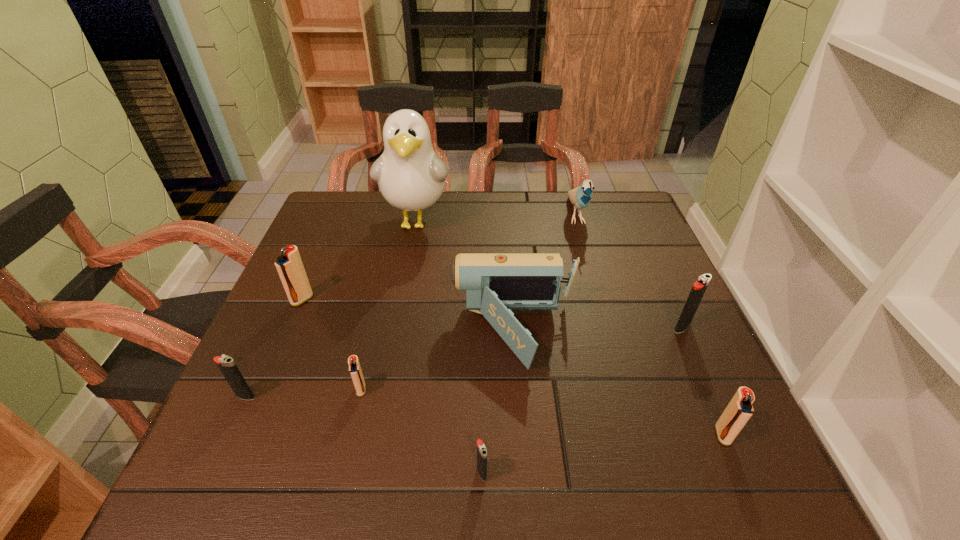
Where is `the leftmost black igniter`? The height and width of the screenshot is (540, 960). the leftmost black igniter is located at coordinates coord(226,364).

Find the location of `the second smallest red igniter`. the second smallest red igniter is located at coordinates (739, 410).

I want to click on the eighth farthest object, so click(x=739, y=410).

The width and height of the screenshot is (960, 540). In order to click on the second red igniter from right to left in this screenshot , I will do `click(355, 371)`.

You are a GUI agent. You are given a task and a screenshot of the screen. Output one action in this format:
    pyautogui.click(x=<x>, y=<y>)
    Task: Click on the smallest red igniter
    
    Given the screenshot: What is the action you would take?
    pyautogui.click(x=355, y=371)

Locate an element on the screen. the fourth igniter from left to right is located at coordinates (481, 448).

What are the coordinates of `the nearest black igniter` in the screenshot? It's located at pos(481,448).

Locate an element on the screen. Image resolution: width=960 pixels, height=540 pixels. vacant space located on the beak of the white gull is located at coordinates (408, 270).

Locate an element on the screen. Image resolution: width=960 pixels, height=540 pixels. vacant position located at the face of the blue bird is located at coordinates (592, 274).

The image size is (960, 540). What are the coordinates of `vacant region located on the side of the camcorder with the flip-out screen` in the screenshot? It's located at (392, 333).